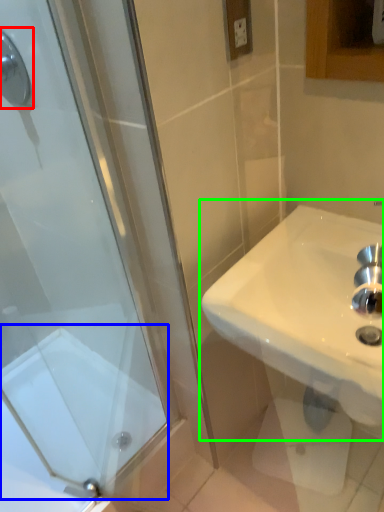
Question: Estimate the real-world distances between objects in this image. Which object is farther from shower (highlighted by a red box), bath (highlighted by a blue box) or sink (highlighted by a green box)?

Choices:
 (A) bath
 (B) sink

Answer: (A)